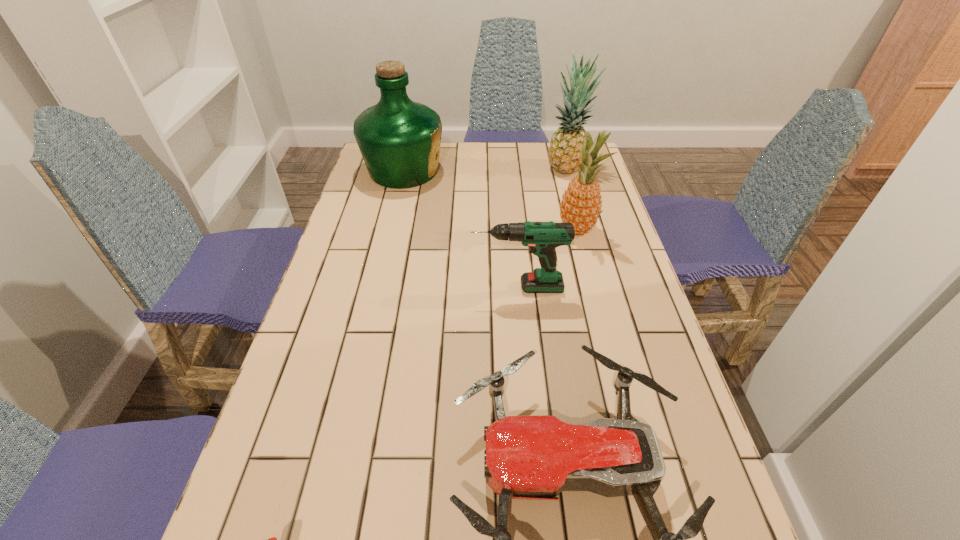
The width and height of the screenshot is (960, 540). In order to click on free location located on the handle side of the drill in this screenshot , I will do `click(404, 287)`.

Identify the location of vacant space located 0.060m on the handle side of the drill. The height and width of the screenshot is (540, 960). (447, 287).

Locate an element on the screen. pineapple positioned at the far edge is located at coordinates (564, 153).

Identify the location of liquor that is positioned at the far edge. (399, 139).

Locate an element on the screen. object present at the left edge is located at coordinates (399, 139).

Where is `object that is at the far left corner`? object that is at the far left corner is located at coordinates (399, 139).

Identify the location of object present at the far right corner. This screenshot has width=960, height=540. (564, 153).

In the image, there is a desktop. Where is `vacant space at the far edge`? Image resolution: width=960 pixels, height=540 pixels. vacant space at the far edge is located at coordinates point(444,171).

Identify the location of vacant area at the left edge. The image size is (960, 540). (355, 191).

I want to click on blank space at the right edge of the desktop, so click(x=636, y=296).